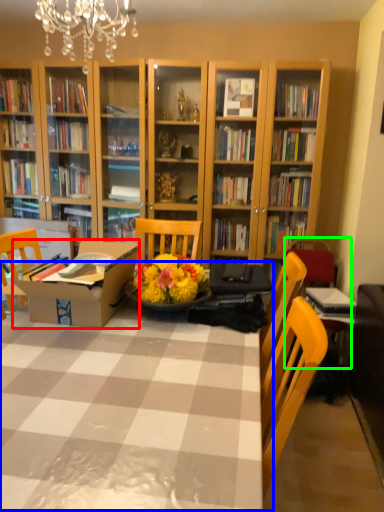
Question: Which object is positioned farthest from cardboard box (highlighted by a red box)? Select from table (highlighted by a blue box) and armchair (highlighted by a green box).

Choices:
 (A) table
 (B) armchair

Answer: (B)